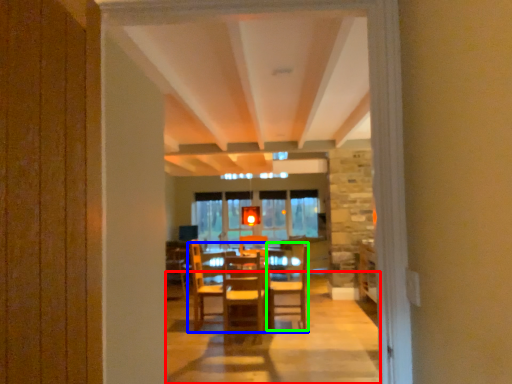
Question: Based on their relative distances, which object is nearer to path (highlighted by a red box)? Choose from table (highlighted by a blue box) and chair (highlighted by a green box).

Choices:
 (A) table
 (B) chair

Answer: (B)